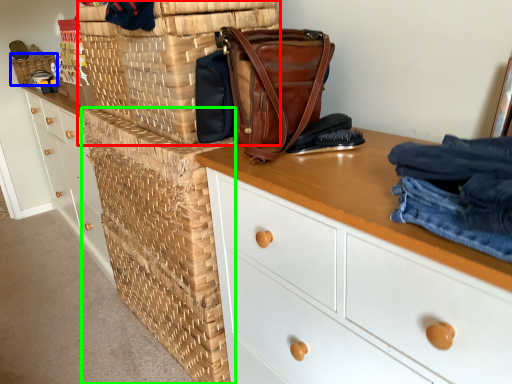
Question: Which is farther away from basket (highlighted by a red box)? basket (highlighted by a blue box) or crate (highlighted by a green box)?

Choices:
 (A) basket
 (B) crate

Answer: (A)